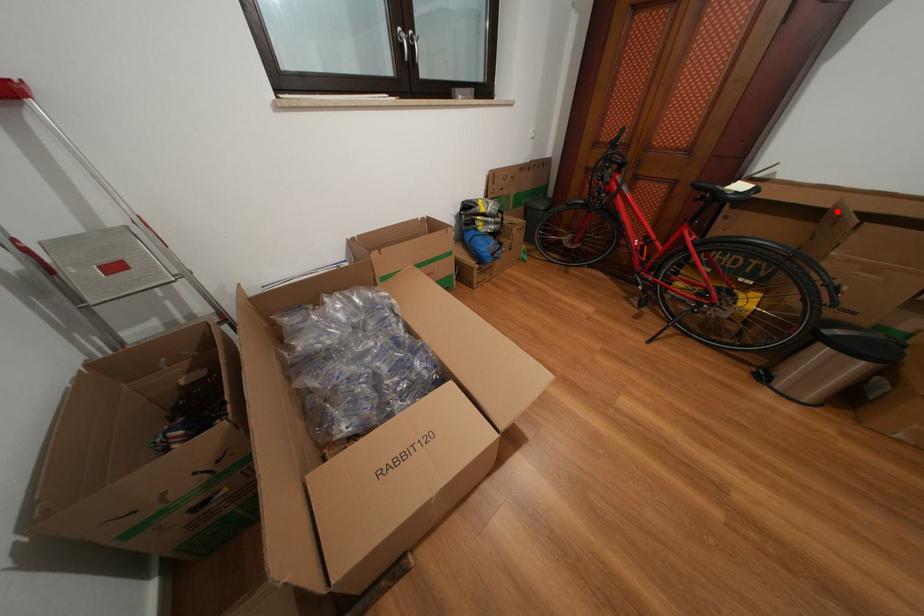
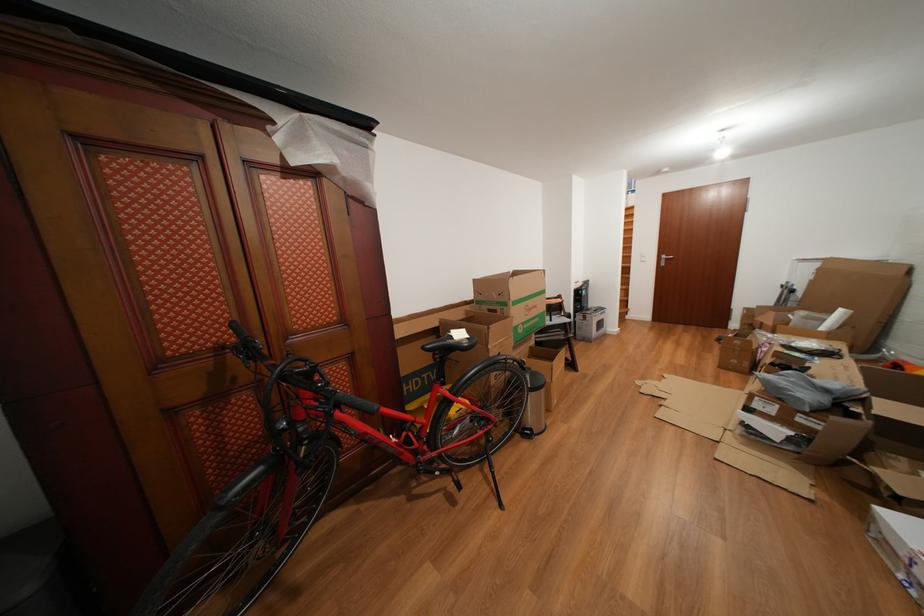
Find the pixel in the second image that matches the highlighted location in the first image.

(445, 330)